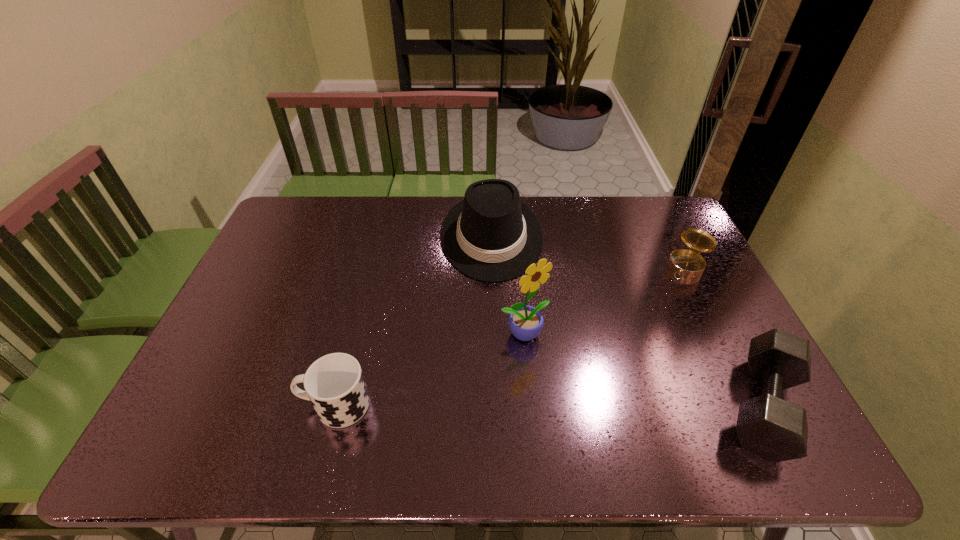
Image resolution: width=960 pixels, height=540 pixels. Find the location of `free space between the cup and the second tallest object`. free space between the cup and the second tallest object is located at coordinates (414, 321).

Where is `free point between the second tallest object and the compass`? Image resolution: width=960 pixels, height=540 pixels. free point between the second tallest object and the compass is located at coordinates (589, 251).

In order to click on free area in between the compass and the fedora in this screenshot , I will do `click(589, 251)`.

Identify the location of vacant space that's between the sunflower and the second tallest object. (508, 285).

Find the location of a particular element. free spot between the fourth shortest object and the leftmost object is located at coordinates (414, 321).

What are the coordinates of `free point between the fourth shortest object and the compass` in the screenshot? It's located at click(589, 251).

At what (x,y) coordinates should I click in order to perform the action: click on free space that is in between the compass and the fedora. Please return your answer as a coordinate pair (x, y). This screenshot has height=540, width=960. Looking at the image, I should click on (589, 251).

The height and width of the screenshot is (540, 960). Find the location of `empty location between the compass and the dumbbell`. empty location between the compass and the dumbbell is located at coordinates (726, 336).

Select which object is the closest to the third farthest object. Please provide its 2D coordinates. Your answer should be formatted as a tuple, i.e. [(x, y)], where the tuple contains the x and y coordinates of a point satisfying the conditions above.

[(490, 235)]

Where is `the second closest object to the dumbbell`? Image resolution: width=960 pixels, height=540 pixels. the second closest object to the dumbbell is located at coordinates (526, 322).